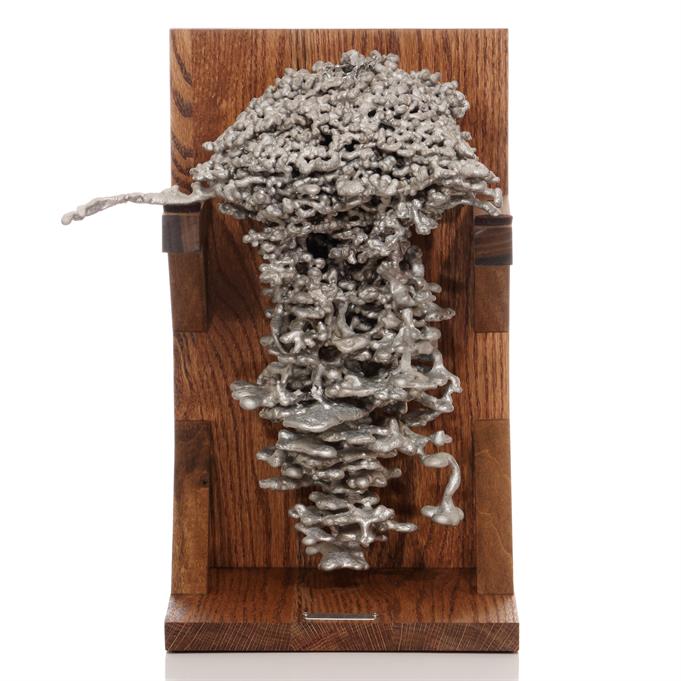
This screenshot has height=681, width=681. Identify the location of silver artwork displayed. (338, 298).